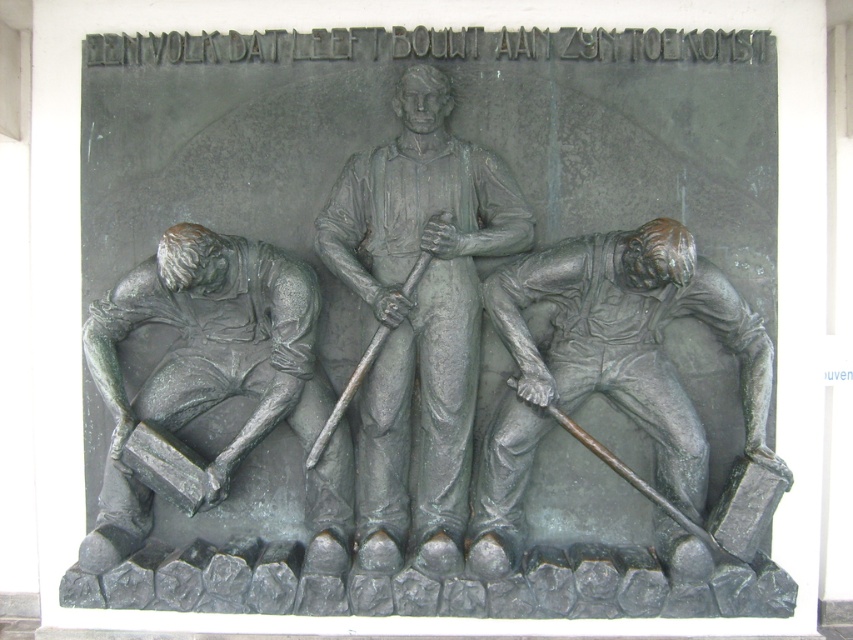
Does point (473, 234) come behind point (117, 296)?

No, it is in front of (117, 296).

Does bronze statue at center come behind bronze figure at lower left?

Yes, bronze statue at center is further from the viewer.

Between point (328, 253) and point (302, 396), which one is positioned in front?

Positioned in front is point (302, 396).

Identify the location of bronze statue at center. (418, 317).

In the scene shown: Is bronze statue at center in front of bronze figure at lower right?

That is False.

Can you confirm if bronze statue at center is shorter than bronze figure at lower right?

No, bronze statue at center is not shorter than bronze figure at lower right.

Does point (432, 244) come farther from viewer compared to point (646, 257)?

Yes, it is behind point (646, 257).

The width and height of the screenshot is (853, 640). I want to click on bronze statue at center, so click(x=418, y=317).

Which is more to the left, bronze figure at lower right or bronze figure at lower left?

Positioned to the left is bronze figure at lower left.

From the picture: Between bronze figure at lower right and bronze figure at lower left, which one appears on the right side from the viewer's perspective?

bronze figure at lower right is more to the right.

Measure the distance between bronze figure at lower right and camera.

bronze figure at lower right and camera are 5.45 meters apart.

Locate an element on the screen. The height and width of the screenshot is (640, 853). bronze figure at lower right is located at coordinates (608, 365).